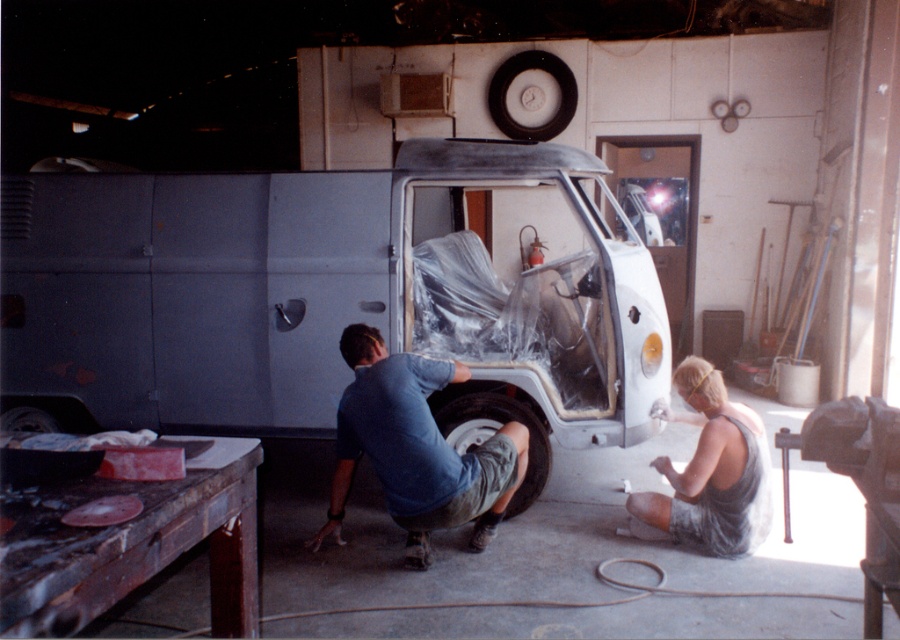
You are a mechanic working in the garage and need to access the black rubber tire at lower center. Is the gray fabric shirt at lower right blocking your path to it?

The gray fabric shirt at lower right is in front of the black rubber tire at lower center, so it is blocking the path to the tire.

You are a mechanic in the garage and need to access the blue cotton shirt at lower center and the black rubber tire at lower center. Which object is closer to your left side?

The blue cotton shirt at lower center is positioned on the left side of black rubber tire at lower center, so it is closer to your left side.